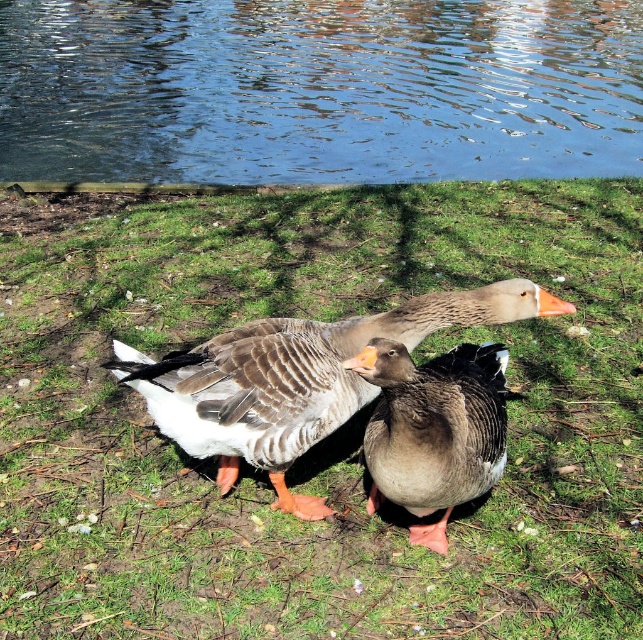
You are a wildlife photographer observing two ducks at a pond. You see a gray feathered duck at center and a gray matte duck at center. Which duck is bigger?

The gray feathered duck at center is larger than the gray matte duck at center.